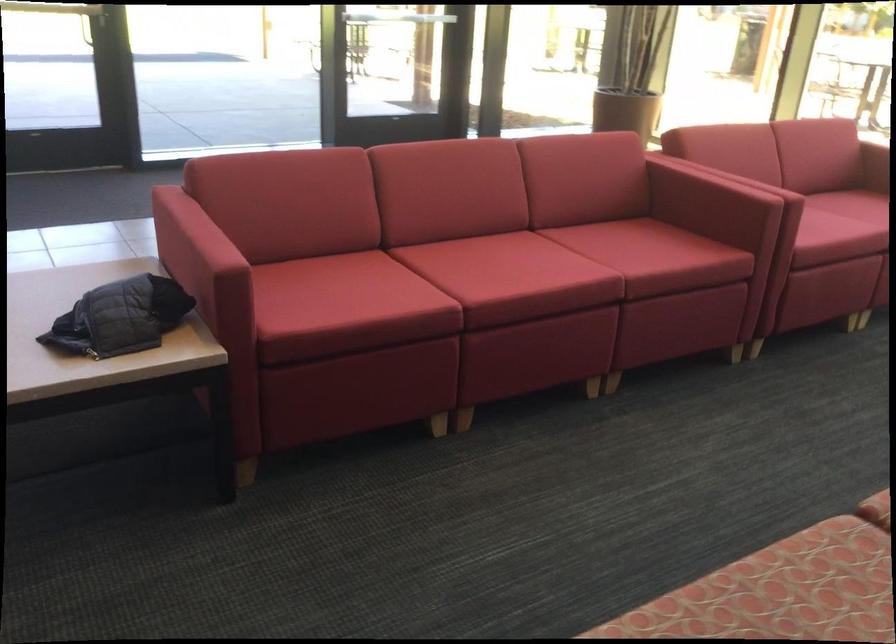
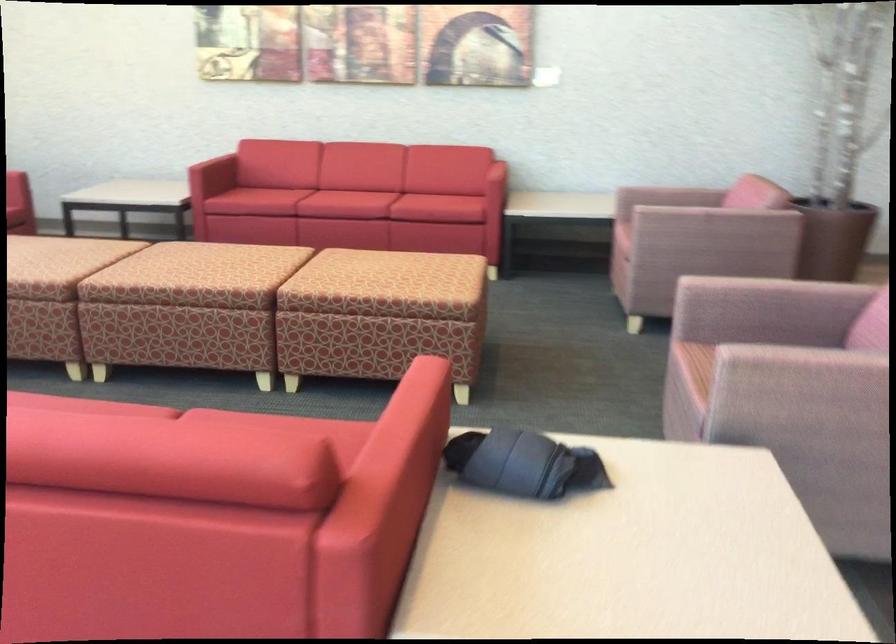
Where in the second image is the point corresponding to point (188, 196) from the first image?

(397, 464)